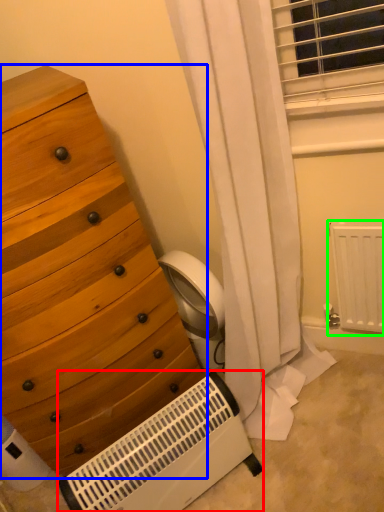
Question: Which object is the farthest from heater (highlighted by a red box)? Choose among these: chest of drawers (highlighted by a blue box) or radiator (highlighted by a green box).

Choices:
 (A) chest of drawers
 (B) radiator

Answer: (B)